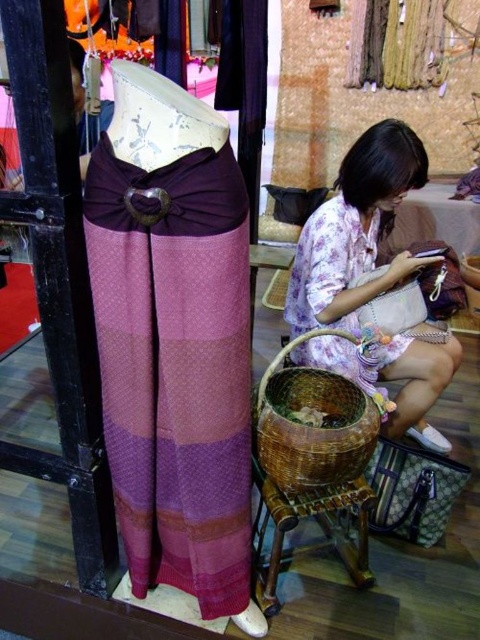
Question: Can you confirm if textured purple skirt at left is positioned to the left of floral fabric dress at lower right?

Choices:
 (A) no
 (B) yes

Answer: (B)

Question: Which object is farther from the camera taking this photo?

Choices:
 (A) brown woven stool at lower center
 (B) brown woven basket at lower center

Answer: (A)

Question: Among these objects, which one is farthest from the camera?

Choices:
 (A) textured purple skirt at left
 (B) brown woven stool at lower center
 (C) floral fabric dress at lower right

Answer: (C)

Question: Can you confirm if floral fabric dress at lower right is thinner than brown woven stool at lower center?

Choices:
 (A) no
 (B) yes

Answer: (A)

Question: Which point is farther to the camera?

Choices:
 (A) textured purple skirt at left
 (B) brown woven basket at lower center
 (C) brown woven stool at lower center

Answer: (C)

Question: Can you confirm if floral fabric dress at lower right is smaller than brown woven basket at lower center?

Choices:
 (A) yes
 (B) no

Answer: (B)